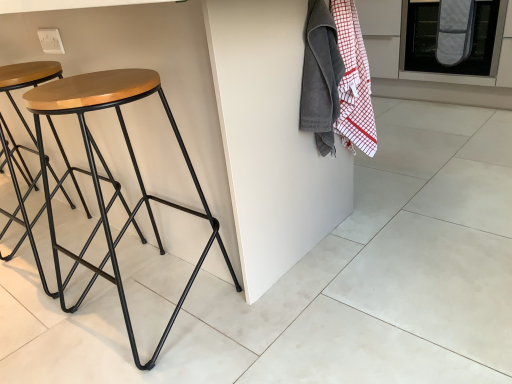
Question: From a real-world perspective, is woodenmaterial/texturestool at left over velvet-like gray blanket at upper right?

Choices:
 (A) yes
 (B) no

Answer: (B)

Question: From a real-world perspective, is woodenmaterial/texturestool at left below velvet-like gray blanket at upper right?

Choices:
 (A) yes
 (B) no

Answer: (A)

Question: Is woodenmaterial/texturestool at left at the left side of velvet-like gray blanket at upper right?

Choices:
 (A) yes
 (B) no

Answer: (A)

Question: Does woodenmaterial/texturestool at left come in front of velvet-like gray blanket at upper right?

Choices:
 (A) no
 (B) yes

Answer: (B)

Question: Is woodenmaterial/texturestool at left at the right side of velvet-like gray blanket at upper right?

Choices:
 (A) yes
 (B) no

Answer: (B)

Question: Considering the positions of white matte tile at lower right and woodenmaterial/texturestool at left in the image, is white matte tile at lower right wider or thinner than woodenmaterial/texturestool at left?

Choices:
 (A) wide
 (B) thin

Answer: (A)

Question: In the image, is white matte tile at lower right positioned in front of or behind woodenmaterial/texturestool at left?

Choices:
 (A) behind
 (B) front

Answer: (A)

Question: Considering the positions of white matte tile at lower right and woodenmaterial/texturestool at left in the image, is white matte tile at lower right bigger or smaller than woodenmaterial/texturestool at left?

Choices:
 (A) big
 (B) small

Answer: (B)

Question: Is white matte tile at lower right situated inside woodenmaterial/texturestool at left or outside?

Choices:
 (A) outside
 (B) inside

Answer: (A)

Question: Does point (173, 130) appear closer or farther from the camera than point (414, 316)?

Choices:
 (A) farther
 (B) closer

Answer: (A)

Question: From a real-world perspective, relative to white matte tile at lower right, is woodenmaterial/texturestool at left vertically above or below?

Choices:
 (A) above
 (B) below

Answer: (A)

Question: Is woodenmaterial/texturestool at left to the left or to the right of white matte tile at lower right in the image?

Choices:
 (A) right
 (B) left

Answer: (B)

Question: From the image's perspective, is woodenmaterial/texturestool at left above or below white matte tile at lower right?

Choices:
 (A) above
 (B) below

Answer: (A)

Question: Considering the positions of gray quilted oven mitt at upper right and velvet-like gray blanket at upper right in the image, is gray quilted oven mitt at upper right taller or shorter than velvet-like gray blanket at upper right?

Choices:
 (A) tall
 (B) short

Answer: (A)

Question: In the image, is gray quilted oven mitt at upper right positioned in front of or behind velvet-like gray blanket at upper right?

Choices:
 (A) behind
 (B) front

Answer: (B)